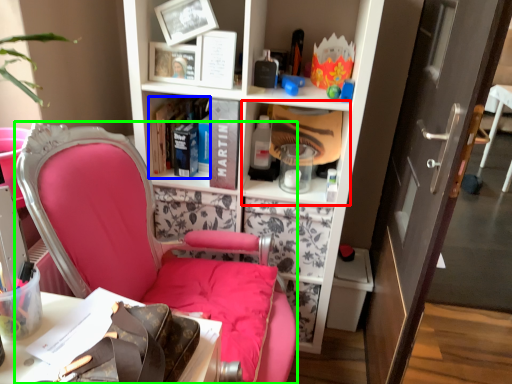
Question: Based on their relative distances, which object is nearer to cabinet (highlighted by a red box)? Choose from book (highlighted by a blue box) and chair (highlighted by a green box).

Choices:
 (A) book
 (B) chair

Answer: (A)